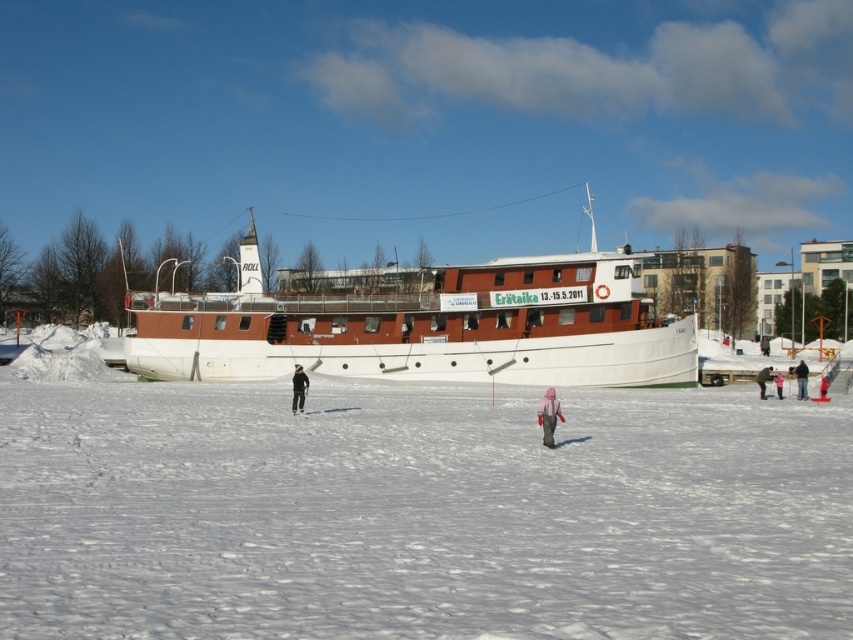
You are a photographer trying to capture a group photo of the two people wearing the pink fleece jacket at center and black matte jacket at center. Since you want to ensure both are visible in the frame, which jacket will appear larger in the photo?

The pink fleece jacket at center will appear larger in the photo because it is taller than the black matte jacket at center.

You are a drone operator trying to capture a photo of the pink fleece jacket at center. Your drone is currently hovering at point 0.5, 0.5. What direction should you move the drone to get closer to the jacket?

The pink fleece jacket at center is located at point [548,417]. Since the drone is at [426,320], you should move the drone northeast to reach the jacket.

In the snowy landscape scene, there is a pink fleece jacket at center and a large boat docked on a frozen waterway. Which object is closer to the point marked at coordinates (548, 417)?

The pink fleece jacket at center is located at point (548, 417), so it is exactly at that coordinate, making it the closest object to the point.